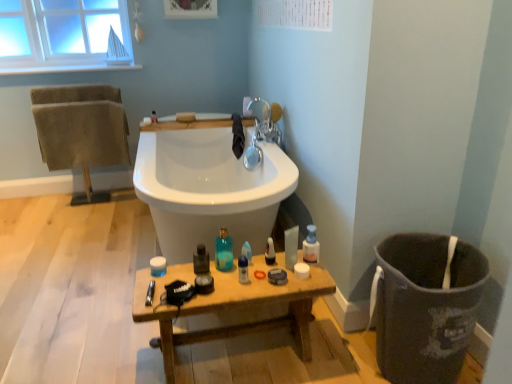
The image size is (512, 384). In order to click on blank area beneath brown textured towels at left, the 2th bath towel from the right (from a real-world perspective) in this screenshot , I will do `click(96, 193)`.